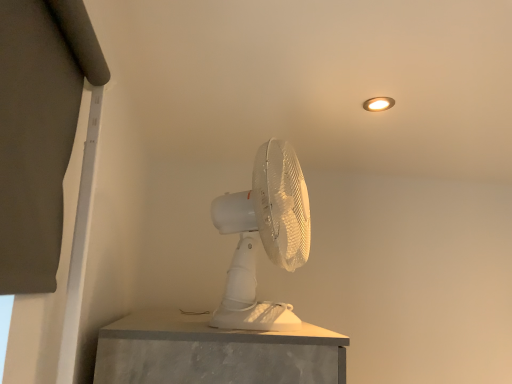
Question: Considering the positions of matte white light fixture at upper right and white plastic mechanical fan at center in the image, is matte white light fixture at upper right taller or shorter than white plastic mechanical fan at center?

Choices:
 (A) short
 (B) tall

Answer: (A)

Question: Considering the positions of point (390, 97) and point (245, 269), is point (390, 97) closer or farther from the camera than point (245, 269)?

Choices:
 (A) closer
 (B) farther

Answer: (B)

Question: Considering the positions of matte white light fixture at upper right and white plastic mechanical fan at center in the image, is matte white light fixture at upper right bigger or smaller than white plastic mechanical fan at center?

Choices:
 (A) small
 (B) big

Answer: (A)

Question: Looking at their shapes, would you say white plastic mechanical fan at center is wider or thinner than matte white light fixture at upper right?

Choices:
 (A) wide
 (B) thin

Answer: (A)

Question: Considering the relative positions of white plastic mechanical fan at center and matte white light fixture at upper right in the image provided, is white plastic mechanical fan at center to the left or to the right of matte white light fixture at upper right?

Choices:
 (A) left
 (B) right

Answer: (A)

Question: Is white plastic mechanical fan at center spatially inside matte white light fixture at upper right, or outside of it?

Choices:
 (A) inside
 (B) outside

Answer: (B)

Question: Considering the positions of point (217, 324) and point (382, 102), is point (217, 324) closer or farther from the camera than point (382, 102)?

Choices:
 (A) farther
 (B) closer

Answer: (B)